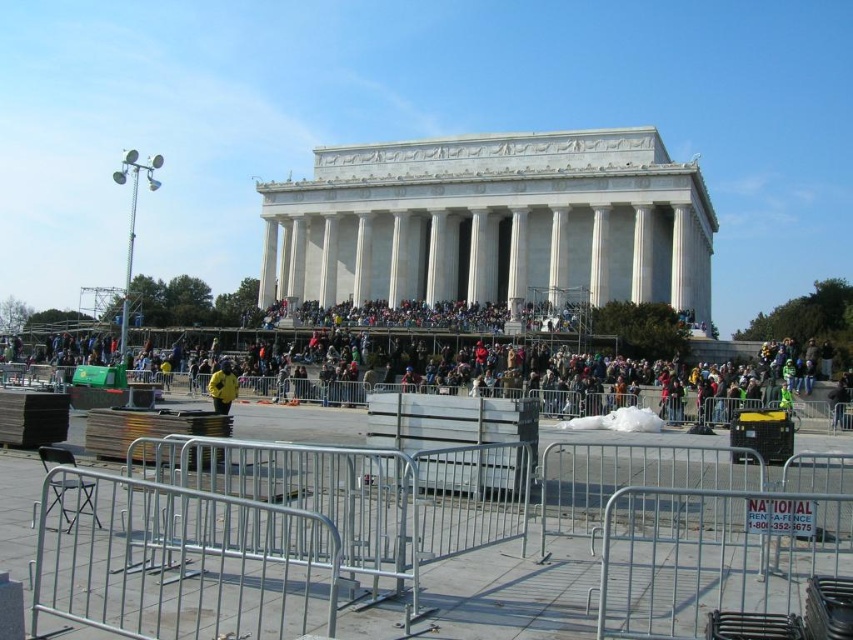
You are standing at the Lincoln Memorial and notice a silver metallic fence at lower center and a yellow jacket at center. Which object is positioned more to the right from your viewpoint?

The silver metallic fence at lower center is to the right of the yellow jacket at center, so the silver metallic fence at lower center is positioned more to the right.

You are standing at the base of the Lincoln Memorial and want to find the dark brown leather jacket at center. According to the coordinates provided, where would you look relative to your current position?

The dark brown leather jacket at center is located at coordinates point [503,360], which is slightly to the right and forward from your current position at the base of the memorial.